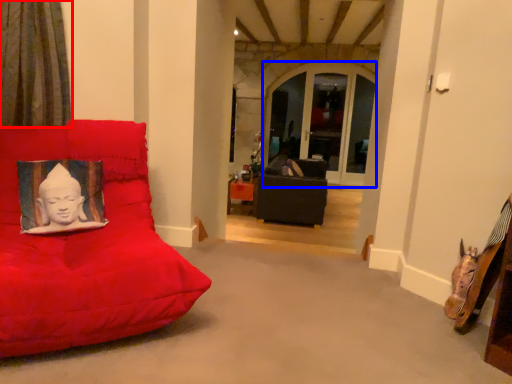
Question: Which point is closer to the camera, curtain (highlighted by a red box) or window (highlighted by a blue box)?

Choices:
 (A) curtain
 (B) window

Answer: (A)